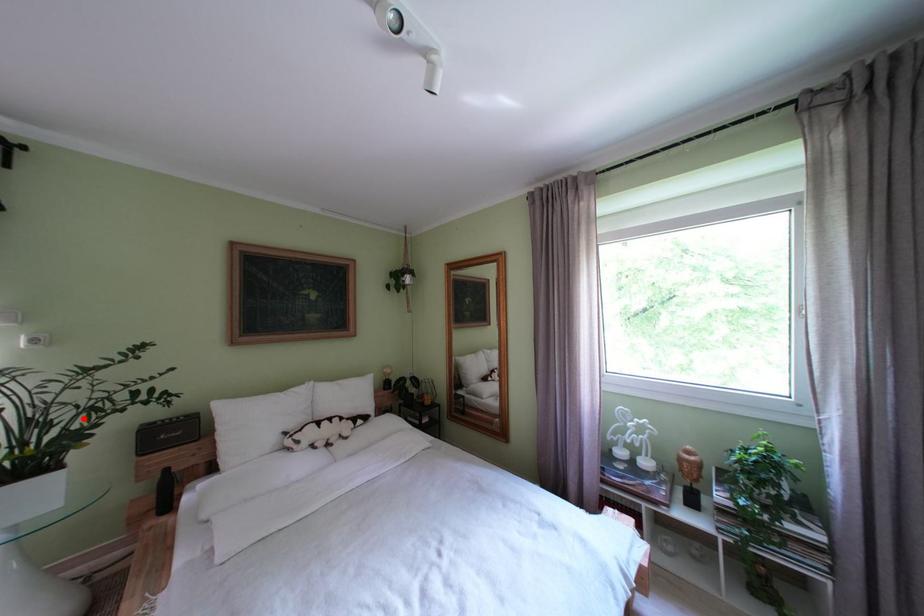
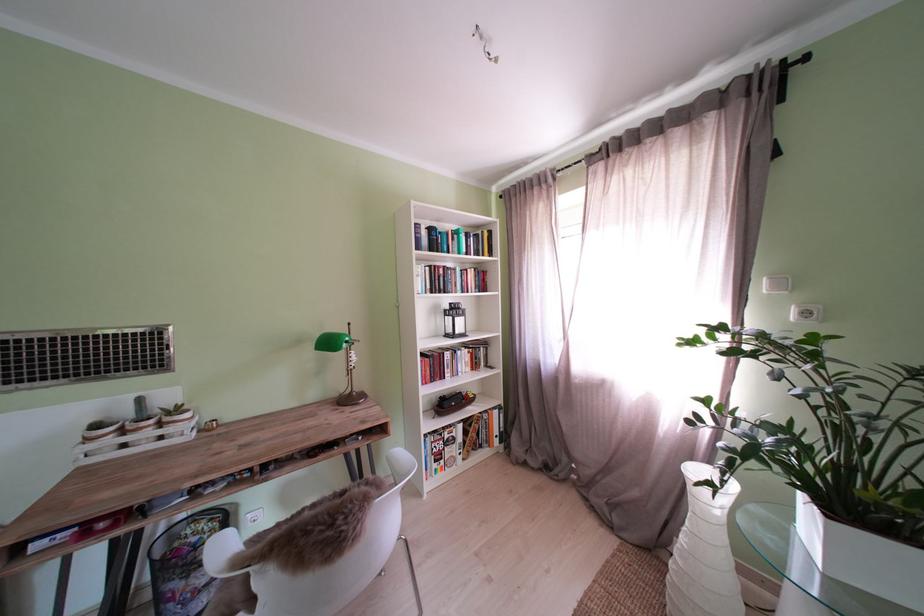
The point at the highlighted location is marked in the first image. Where is the corresponding point in the second image?

(909, 446)